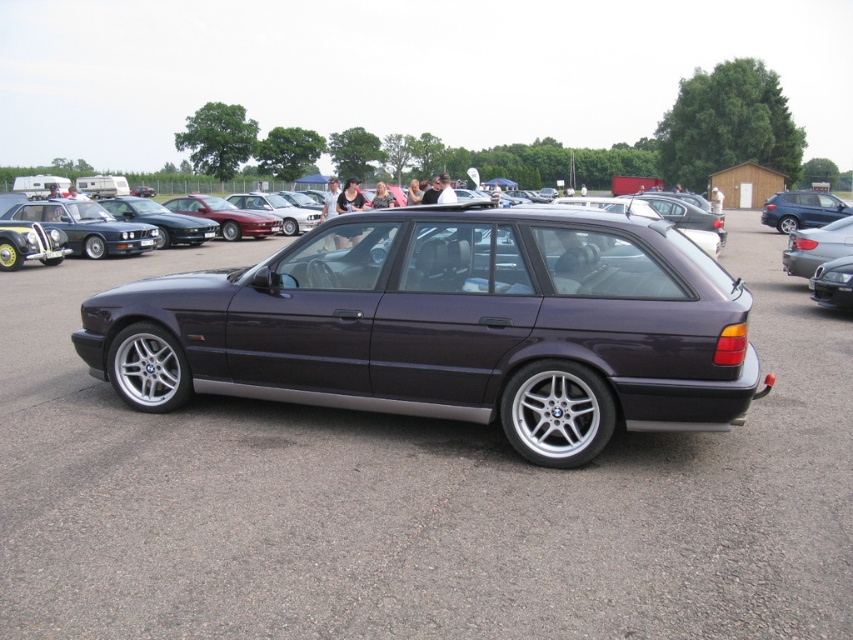
Question: In this image, where is metallic gray car at center located relative to silver metallic rim at lower left?

Choices:
 (A) left
 (B) right

Answer: (B)

Question: Which object is the closest to the shiny silver car at left?

Choices:
 (A) silver metallic rim at lower center
 (B) metallic gray car at center

Answer: (B)

Question: Does silver metallic rim at lower left appear on the left side of satin silver car at right?

Choices:
 (A) no
 (B) yes

Answer: (B)

Question: Can you confirm if silver metallic rim at lower center is positioned to the right of satin silver car at right?

Choices:
 (A) yes
 (B) no

Answer: (B)

Question: Which point is closer to the camera?

Choices:
 (A) (167, 348)
 (B) (15, 349)
 (C) (831, 244)
 (D) (601, 419)

Answer: (D)

Question: Which object is closer to the camera taking this photo?

Choices:
 (A) silver metallic rim at lower left
 (B) satin silver car at right
 (C) satin blue wagon at right

Answer: (A)